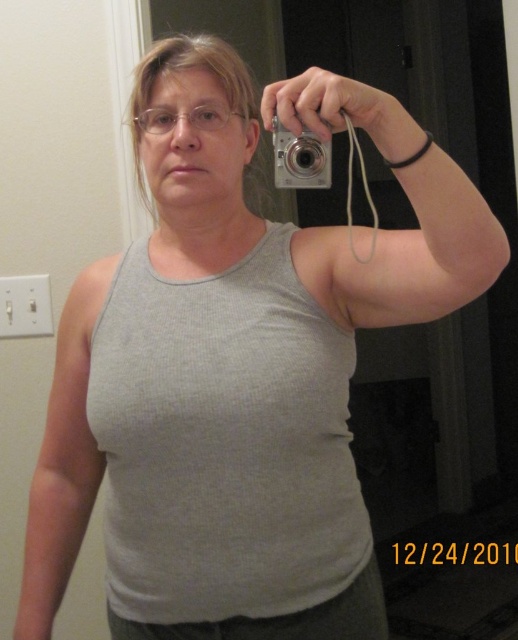
Can you confirm if gray ribbed tank top at center is smaller than silver metallic camera at upper center?

Incorrect, gray ribbed tank top at center is not smaller in size than silver metallic camera at upper center.

Is point (272, 570) less distant than point (280, 166)?

No, (272, 570) is further to viewer.

Between point (156, 588) and point (304, 182), which one is positioned in front?

Point (304, 182) is in front.

You are a GUI agent. You are given a task and a screenshot of the screen. Output one action in this format:
    pyautogui.click(x=<x>, y=<y>)
    Task: Click on the gray ribbed tank top at center
    
    Given the screenshot: What is the action you would take?
    pyautogui.click(x=224, y=442)

At what (x,y) coordinates should I click in order to perform the action: click on gray ribbed tank top at center. Please return your answer as a coordinate pair (x, y). The height and width of the screenshot is (640, 518). Looking at the image, I should click on (224, 442).

Between gray ribbed tank top at center and clear plastic glasses at center, which one appears on the right side from the viewer's perspective?

From the viewer's perspective, gray ribbed tank top at center appears more on the right side.

The image size is (518, 640). In order to click on gray ribbed tank top at center in this screenshot , I will do `click(224, 442)`.

Can you confirm if silver metallic camera at upper center is taller than clear plastic glasses at center?

Yes, silver metallic camera at upper center is taller than clear plastic glasses at center.

Find the location of a particular element. silver metallic camera at upper center is located at coordinates (299, 160).

Which is behind, point (323, 179) or point (215, 116)?

The point (215, 116) is more distant.

You are a GUI agent. You are given a task and a screenshot of the screen. Output one action in this format:
    pyautogui.click(x=<x>, y=<y>)
    Task: Click on the silver metallic camera at upper center
    The image size is (518, 640).
    Given the screenshot: What is the action you would take?
    pyautogui.click(x=299, y=160)